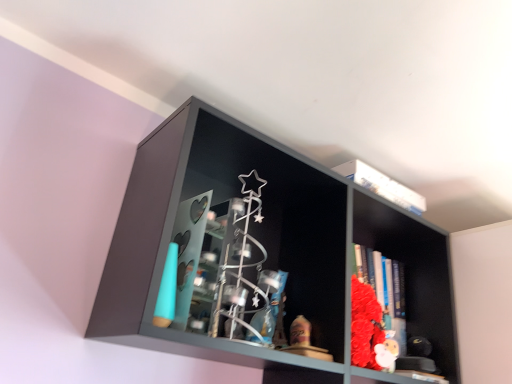
Question: Can you confirm if matte black shelf at center is taller than white plush toy at lower right?

Choices:
 (A) yes
 (B) no

Answer: (A)

Question: Could you tell me if matte black shelf at center is turned towards white plush toy at lower right?

Choices:
 (A) yes
 (B) no

Answer: (A)

Question: Is matte black shelf at center oriented away from white plush toy at lower right?

Choices:
 (A) yes
 (B) no

Answer: (A)

Question: Is matte black shelf at center beside white plush toy at lower right?

Choices:
 (A) no
 (B) yes

Answer: (A)

Question: From a real-world perspective, is matte black shelf at center below white plush toy at lower right?

Choices:
 (A) no
 (B) yes

Answer: (A)

Question: Considering the relative positions of matte black shelf at center and white plush toy at lower right in the image provided, is matte black shelf at center behind white plush toy at lower right?

Choices:
 (A) yes
 (B) no

Answer: (B)

Question: Does white plush toy at lower right contain matte black shelf at center?

Choices:
 (A) yes
 (B) no

Answer: (B)

Question: Is white plush toy at lower right completely or partially outside of matte black shelf at center?

Choices:
 (A) yes
 (B) no

Answer: (B)

Question: Is white plush toy at lower right positioned far away from matte black shelf at center?

Choices:
 (A) yes
 (B) no

Answer: (B)

Question: Is matte black shelf at center at the back of white plush toy at lower right?

Choices:
 (A) yes
 (B) no

Answer: (A)

Question: Does white plush toy at lower right come behind matte black shelf at center?

Choices:
 (A) yes
 (B) no

Answer: (A)

Question: Is white plush toy at lower right thinner than matte black shelf at center?

Choices:
 (A) no
 (B) yes

Answer: (B)

Question: Considering the positions of matte black shelf at center and white plush toy at lower right in the image, is matte black shelf at center bigger or smaller than white plush toy at lower right?

Choices:
 (A) big
 (B) small

Answer: (A)